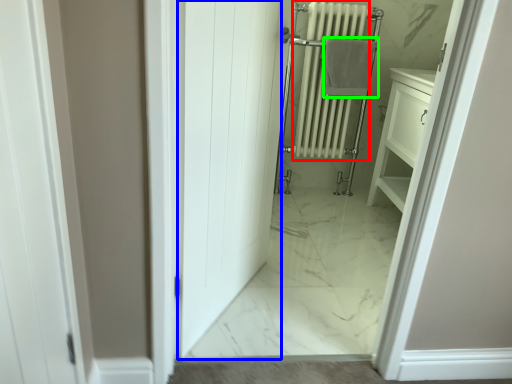
Question: Estimate the real-world distances between objects in this image. Which object is closer to radiator (highlighted by a red box), door (highlighted by a blue box) or bath towel (highlighted by a green box)?

Choices:
 (A) door
 (B) bath towel

Answer: (B)